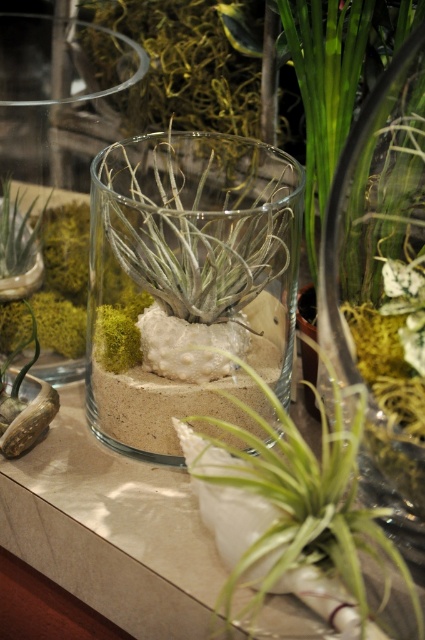
Question: Which point appears farthest from the camera in this image?

Choices:
 (A) (158, 321)
 (B) (192, 468)
 (C) (11, 234)

Answer: (C)

Question: Is green leafy plant at center smaller than green moss at left?

Choices:
 (A) no
 (B) yes

Answer: (A)

Question: Which object appears closest to the camera in this image?

Choices:
 (A) green moss at left
 (B) green leafy plant at center
 (C) clear glass vase at center

Answer: (B)

Question: Is clear glass vase at center bigger than green leafy plant at center?

Choices:
 (A) no
 (B) yes

Answer: (B)

Question: Does clear glass vase at center have a larger size compared to green moss at left?

Choices:
 (A) no
 (B) yes

Answer: (B)

Question: Which object is farther from the camera taking this photo?

Choices:
 (A) green leafy plant at center
 (B) clear glass vase at center
 (C) green moss at left

Answer: (C)